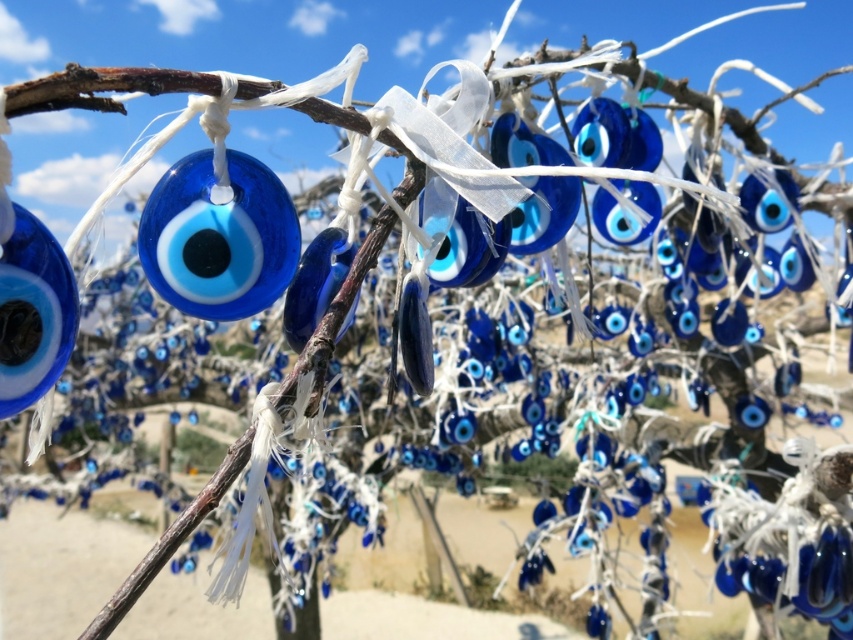
You are an artist trying to create a balanced composition using the glossy glass eye at center and the blue glass bead at left. Since you want them to appear similar in size, which object should you move closer to the viewer?

The glossy glass eye at center is bigger than the blue glass bead at left, so to make them appear similar in size, you should move the blue glass bead at left closer to the viewer.

You are standing in front of the tree and want to locate the glossy glass eye at center. According to the coordinates provided, where should you look relative to the tree?

The glossy glass eye at center is located at coordinates point (218, 237), which means it is positioned approximately 37.2 percent from the left edge and 25.7 percent from the bottom edge of the tree.